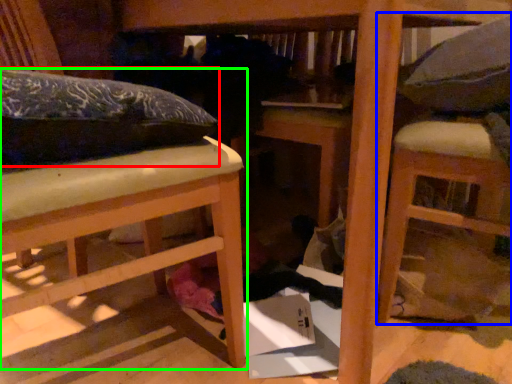
Question: Which object is positioned farthest from leftover (highlighted by a red box)? Select from furniture (highlighted by a blue box) and furniture (highlighted by a green box).

Choices:
 (A) furniture
 (B) furniture

Answer: (A)